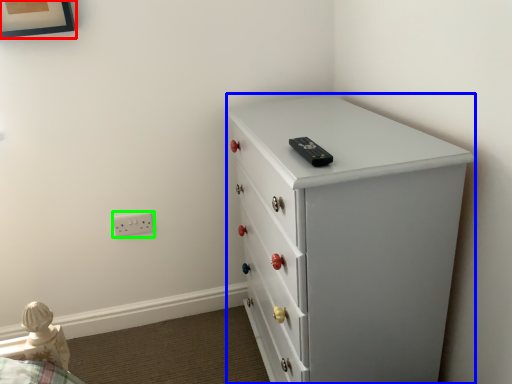
Question: Considering the real-world distances, which object is farthest from picture frame (highlighted by a red box)? chest of drawers (highlighted by a blue box) or electric outlet (highlighted by a green box)?

Choices:
 (A) chest of drawers
 (B) electric outlet

Answer: (A)